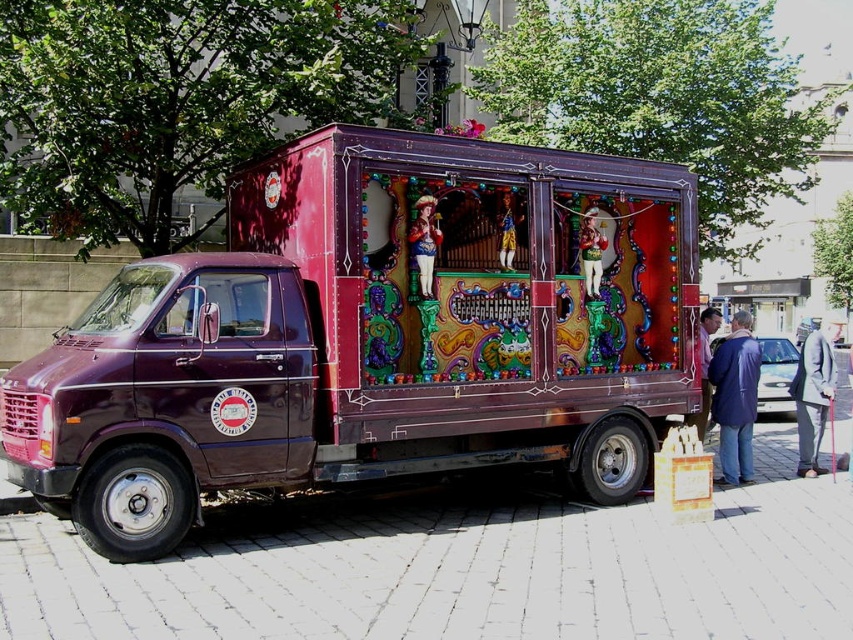
You are standing in front of the van and notice two items inside the cargo area. You want to move a small package from the shiny purple truck at center to the gray suit at right. Which direction should you move the package?

The shiny purple truck at center is to the left of the gray suit at right, so you should move the package to the right.

You are standing on the cobblestone street in front of the van and want to take a photo of the shiny purple truck at center. Where should you position yourself to capture the truck in the center of your camera frame?

Position yourself directly in front of the shiny purple truck at center, as its 2D location is at point (369, 337), which is centrally located on the van.